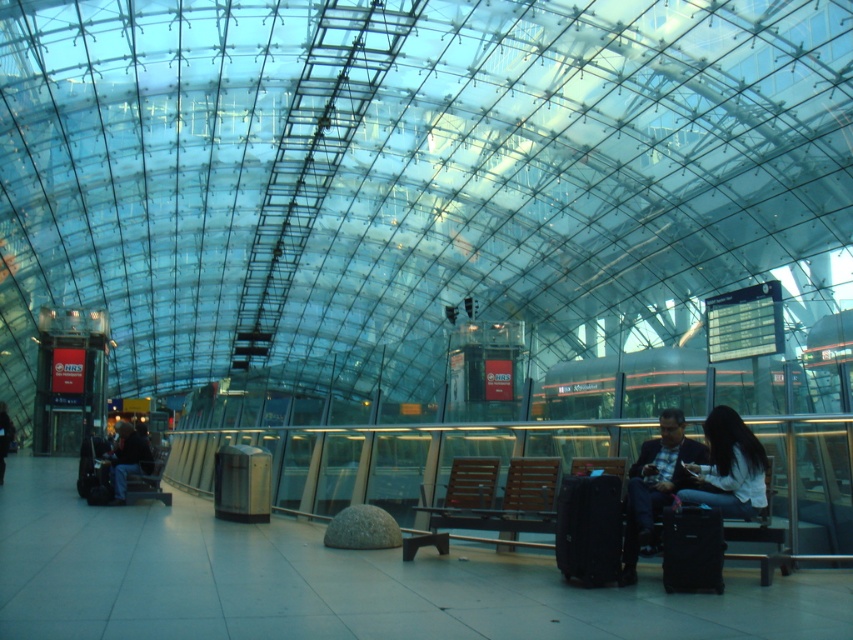
You are standing at the entrance of the terminal and see two points marked on the floor. The first point is labeled as point (695, 550) and the second is point (0, 417). If you want to walk towards the point that is closer to the entrance, which point should you head towards?

Point (0, 417) is closer to the entrance because it is behind point (695, 550), which is in front of it.

You are a traveler standing at the entrance of the terminal. You see a person wearing a white matte shirt at lower right and dark blue jeans at left. Which clothing item is closer to you?

The white matte shirt at lower right is closer to you because it is in front of the dark blue jeans at left.

From the picture: You are standing at the entrance of the terminal and want to locate the white matte shirt at lower right. According to the coordinates provided, where should you look to find it?

The white matte shirt at lower right is located at coordinates point (729, 467), so you should look towards the lower right area of the terminal to find it.